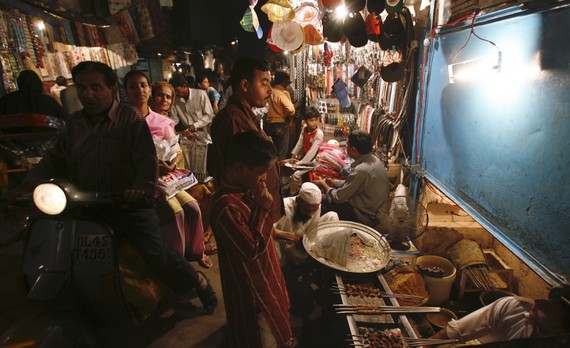
The width and height of the screenshot is (570, 348). In order to click on wall in this screenshot , I will do `click(526, 192)`.